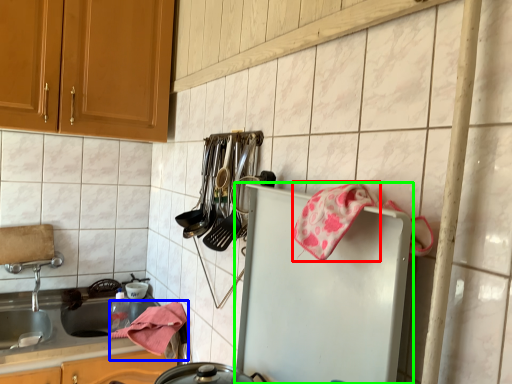
Question: Considering the real-world distances, which object is farthest from material (highlighted by a red box)? material (highlighted by a blue box) or refrigerator (highlighted by a green box)?

Choices:
 (A) material
 (B) refrigerator

Answer: (A)